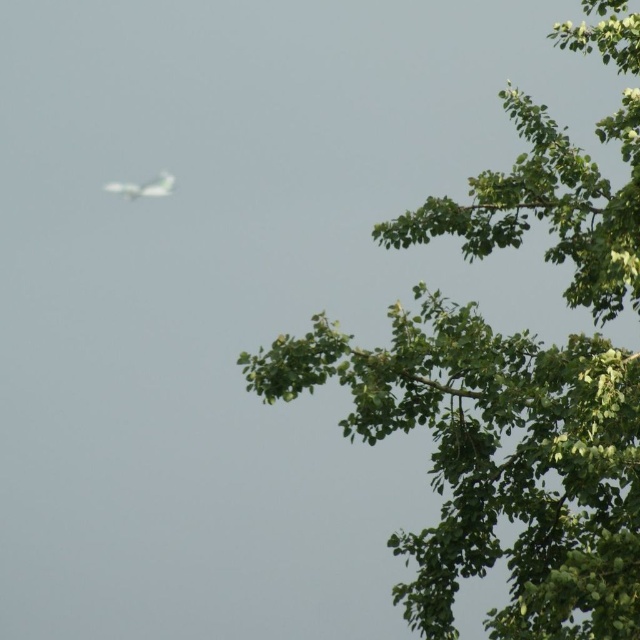
Which is more to the right, green leafy tree at upper right or white matte airplane at upper left?

green leafy tree at upper right is more to the right.

Which is above, green leafy tree at upper right or white matte airplane at upper left?

white matte airplane at upper left

What do you see at coordinates (497, 461) in the screenshot? The height and width of the screenshot is (640, 640). I see `green leafy tree at upper right` at bounding box center [497, 461].

Where is `green leafy tree at upper right`? Image resolution: width=640 pixels, height=640 pixels. green leafy tree at upper right is located at coordinates (497, 461).